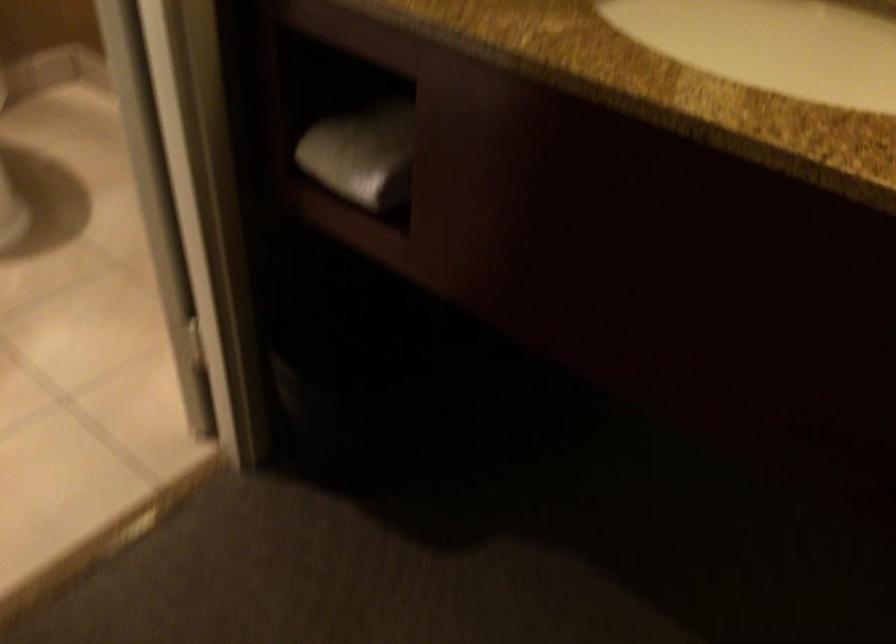
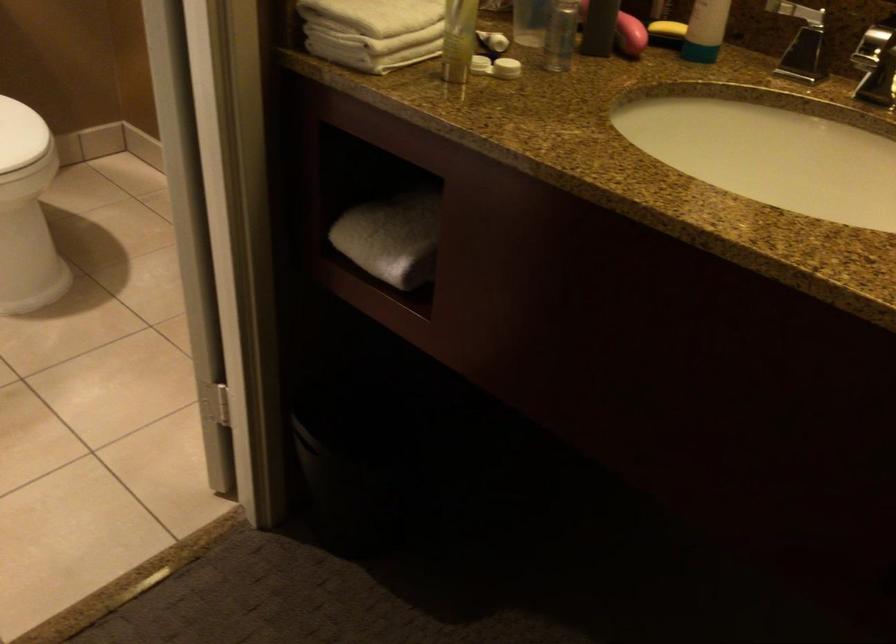
Question: What movement of the cameraman would produce the second image?

Choices:
 (A) Left
 (B) Right
 (C) Forward
 (D) Backward

Answer: (D)